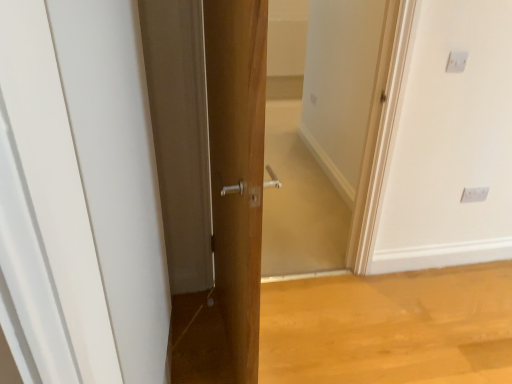
Question: Does white plastic electric outlet at upper right, which ranks as the first electric outlet in front-to-back order, have a lesser width compared to white glossy door at center?

Choices:
 (A) yes
 (B) no

Answer: (A)

Question: Does white plastic electric outlet at upper right, which ranks as the first electric outlet in front-to-back order, have a greater height compared to white glossy door at center?

Choices:
 (A) no
 (B) yes

Answer: (A)

Question: Is white plastic electric outlet at upper right, marked as the first electric outlet in a left-to-right arrangement, facing towards white glossy door at center?

Choices:
 (A) no
 (B) yes

Answer: (A)

Question: Is white plastic electric outlet at upper right, placed as the second electric outlet when sorted from right to left, surrounding white glossy door at center?

Choices:
 (A) yes
 (B) no

Answer: (B)

Question: Can you confirm if white plastic electric outlet at upper right, placed as the second electric outlet when sorted from right to left, is positioned to the left of white glossy door at center?

Choices:
 (A) no
 (B) yes

Answer: (A)

Question: From the image's perspective, is white glossy door at center above or below white plastic electric outlet at upper right, which is counted as the first electric outlet, starting from the right?

Choices:
 (A) below
 (B) above

Answer: (A)

Question: Would you say white glossy door at center is to the left or to the right of white plastic electric outlet at upper right, which ranks as the 1th electric outlet in back-to-front order, in the picture?

Choices:
 (A) right
 (B) left

Answer: (B)

Question: In the image, is white glossy door at center positioned in front of or behind white plastic electric outlet at upper right, marked as the 2th electric outlet in a top-to-bottom arrangement?

Choices:
 (A) behind
 (B) front

Answer: (B)

Question: Which is correct: white glossy door at center is inside white plastic electric outlet at upper right, which is the 2th electric outlet in left-to-right order, or outside of it?

Choices:
 (A) inside
 (B) outside

Answer: (B)

Question: Looking at their shapes, would you say white glossy door at center is wider or thinner than white plastic electric outlet at upper right, placed as the second electric outlet when sorted from right to left?

Choices:
 (A) thin
 (B) wide

Answer: (B)

Question: Does point (80, 120) appear closer or farther from the camera than point (462, 71)?

Choices:
 (A) closer
 (B) farther

Answer: (A)

Question: Considering the positions of white glossy door at center and white plastic electric outlet at upper right, marked as the first electric outlet in a left-to-right arrangement, in the image, is white glossy door at center taller or shorter than white plastic electric outlet at upper right, marked as the first electric outlet in a left-to-right arrangement,?

Choices:
 (A) tall
 (B) short

Answer: (A)

Question: Based on their sizes in the image, would you say white glossy door at center is bigger or smaller than white plastic electric outlet at upper right, which appears as the 1th electric outlet when viewed from the top?

Choices:
 (A) big
 (B) small

Answer: (A)

Question: From the image's perspective, is white plastic electric outlet at upper right, placed as the second electric outlet when sorted from right to left, located above or below white plastic electric outlet at upper right, which is the 2th electric outlet in left-to-right order?

Choices:
 (A) above
 (B) below

Answer: (A)

Question: Is point (456, 61) closer or farther from the camera than point (480, 190)?

Choices:
 (A) closer
 (B) farther

Answer: (A)